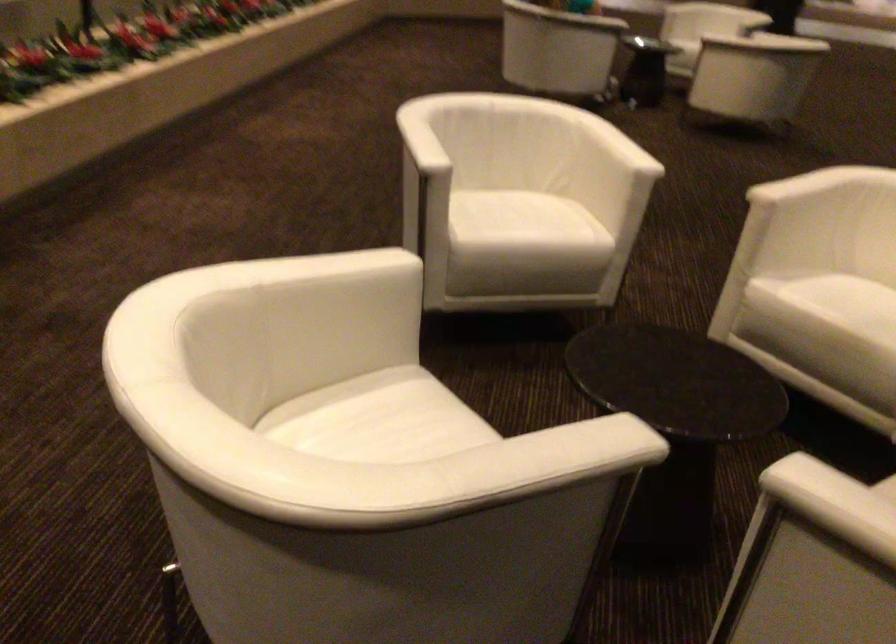
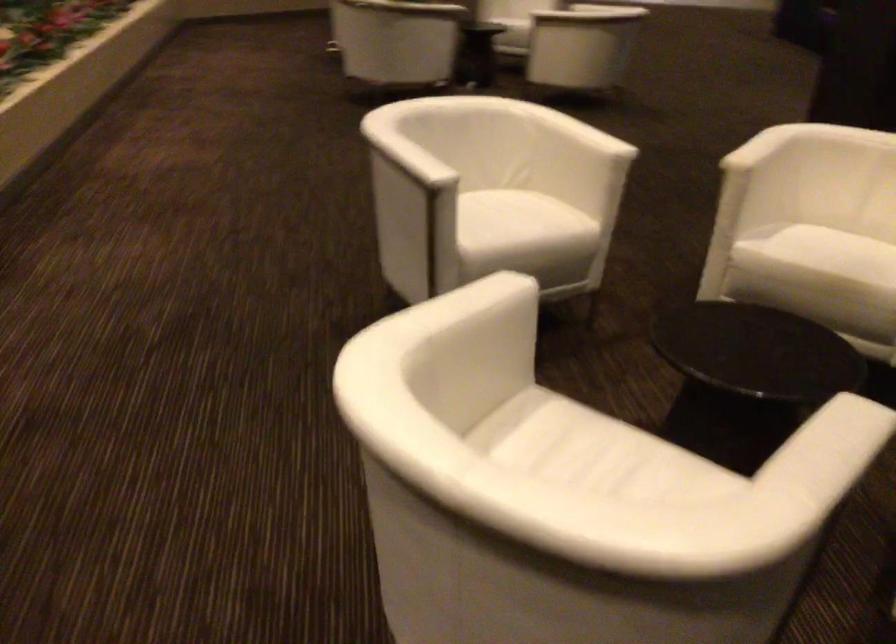
Find the pixel in the second image that matches pixel 549 453 in the first image.

(839, 446)